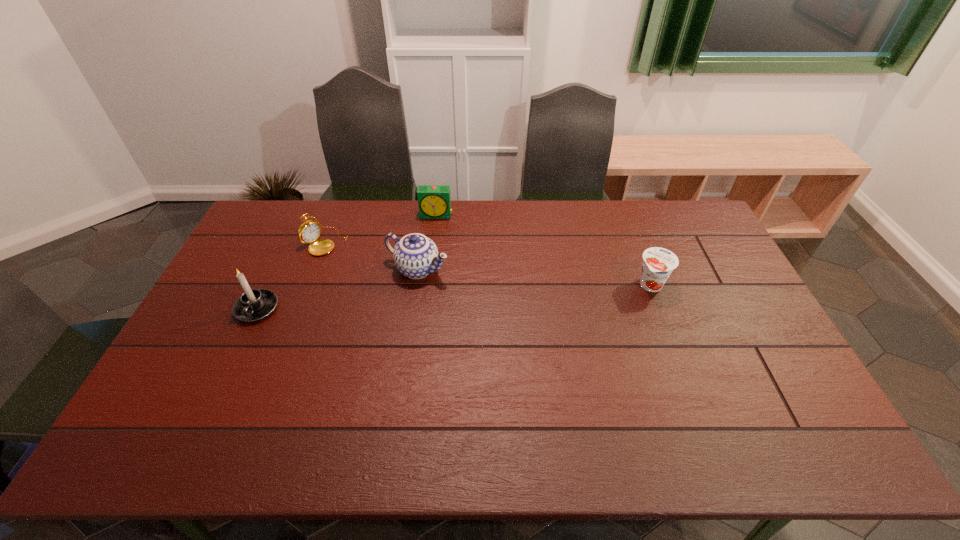
At what (x,y) coordinates should I click in order to perform the action: click on vacant area situated 0.400m on the front-facing side of the alarm clock. Please return your answer as a coordinate pair (x, y). This screenshot has height=540, width=960. Looking at the image, I should click on (424, 298).

The image size is (960, 540). I want to click on vacant position located on the front-facing side of the alarm clock, so coord(427,280).

This screenshot has height=540, width=960. Identify the location of vacant area situated 0.130m on the front-facing side of the alarm clock. (432, 241).

What are the coordinates of `vacant space positioned 0.350m on the face of the pocket watch` in the screenshot? It's located at (412, 297).

Locate an element on the screen. This screenshot has width=960, height=540. free space located on the face of the pocket watch is located at coordinates coord(390,283).

In order to click on blank space located 0.350m on the face of the pocket watch in this screenshot , I will do `click(412, 297)`.

Where is `alarm clock present at the far edge`? alarm clock present at the far edge is located at coordinates (434, 201).

Where is `pocket watch that is at the far edge`? The width and height of the screenshot is (960, 540). pocket watch that is at the far edge is located at coordinates (308, 233).

What are the coordinates of `object that is at the left edge` in the screenshot? It's located at (254, 304).

At what (x,y) coordinates should I click in order to perform the action: click on vacant point at the far edge. Please return your answer as a coordinate pair (x, y). Looking at the image, I should click on (557, 214).